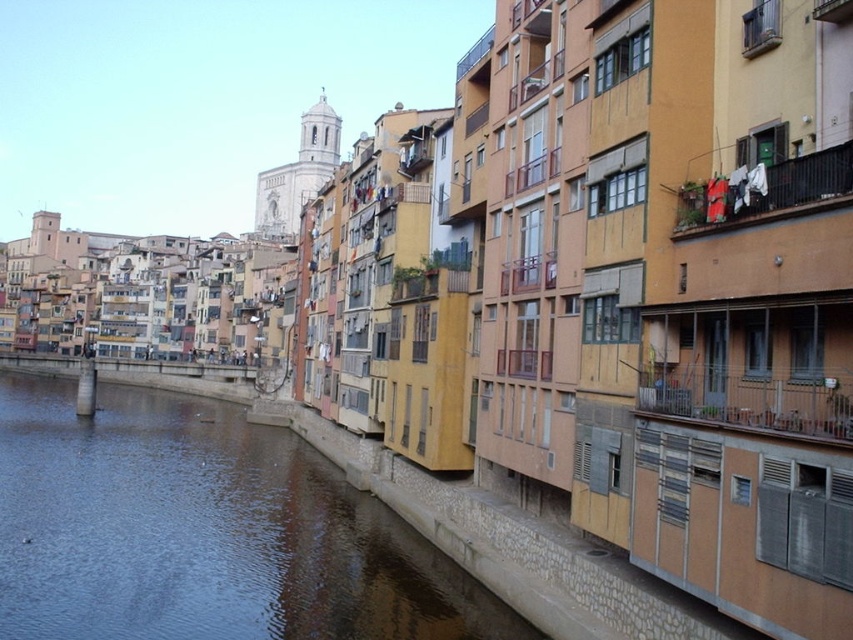
Consider the image. You are standing on the riverside path and want to take a photo of both the blue water at lower left and the white fabric at upper right. Which object should you focus on first to ensure both are in the frame?

You should focus on the blue water at lower left first because it is closer to you than the white fabric at upper right, so adjusting the camera to include it will naturally include the farther object as well.

You are standing at the riverside and want to take a photo of the point at coordinate point (315,506). The camera you have can focus up to 100 meters. Will you be able to capture the point in focus?

The point at coordinate point (315,506) is 70.58 meters from the camera, which is within the camera focus range of up to 100 meters. Therefore, the camera can focus on the point.

You are standing at the center of the riverside scene and want to reach the blue water at lower left. Which direction should you move to get there?

To reach the blue water at lower left, you should move towards the lower left direction from your current position at the center of the scene.